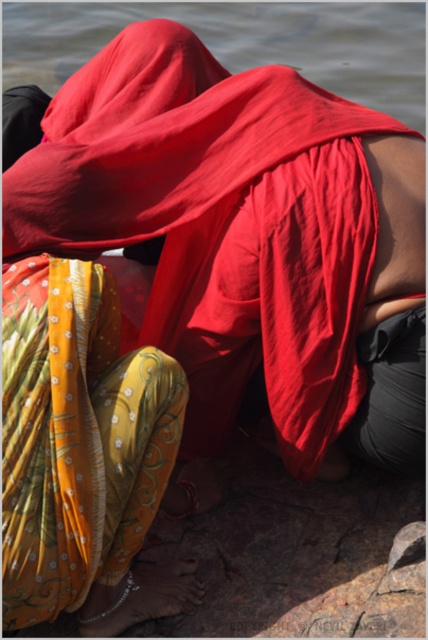
You are a photographer trying to capture the yellow floral fabric at lower left and the transparent water at upper center in the same frame. Based on their positions, which object should you focus on first to ensure both are in focus?

The yellow floral fabric at lower left is much taller than the transparent water at upper center, so focusing on the yellow floral fabric at lower left first will help ensure both are in focus since it is closer to the camera.

You are an artist planning to paint the scene. You have a limited amount of yellow paint. The yellow floral fabric at lower left and transparent water at upper center both require yellow paint. Which object should you use the yellow paint for first to ensure you have enough?

The yellow floral fabric at lower left requires more yellow paint since it is larger in size than the transparent water at upper center.